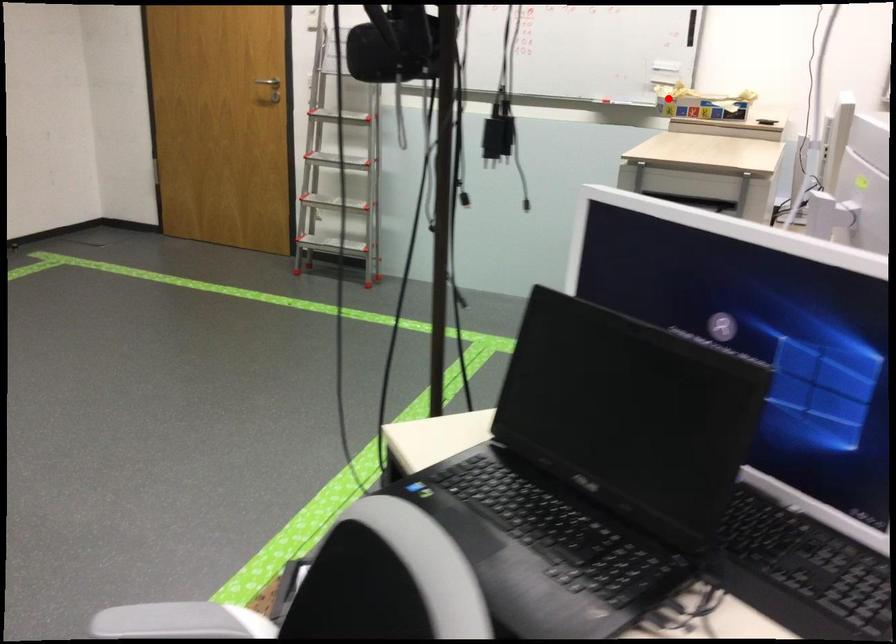
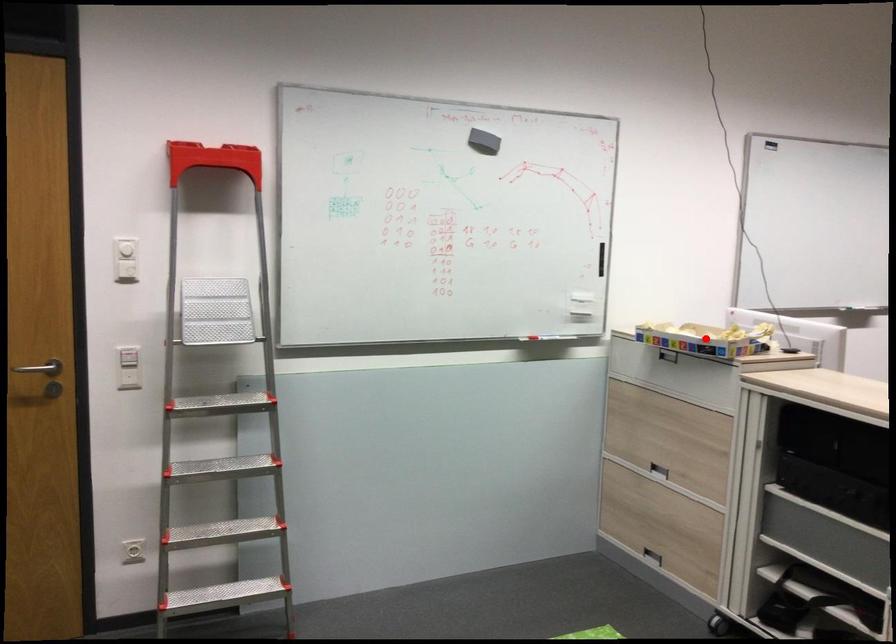
I am providing you with two images of the same scene from different viewpoints. A red point is marked on the first image and another point is marked on the second image. Is the marked point in image1 the same physical position as the marked point in image2?

Yes